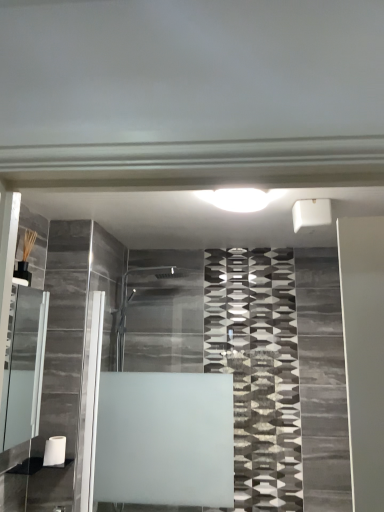
Question: Considering the relative sizes of matte glass cabinet at left and white matte toilet paper at lower left in the image provided, is matte glass cabinet at left shorter than white matte toilet paper at lower left?

Choices:
 (A) no
 (B) yes

Answer: (A)

Question: From the image's perspective, is matte glass cabinet at left below white matte toilet paper at lower left?

Choices:
 (A) yes
 (B) no

Answer: (B)

Question: Is matte glass cabinet at left facing towards white matte toilet paper at lower left?

Choices:
 (A) no
 (B) yes

Answer: (A)

Question: From the image's perspective, is matte glass cabinet at left located above white matte toilet paper at lower left?

Choices:
 (A) no
 (B) yes

Answer: (B)

Question: From a real-world perspective, is matte glass cabinet at left on white matte toilet paper at lower left?

Choices:
 (A) yes
 (B) no

Answer: (A)

Question: In terms of size, does white matte toilet paper at lower left appear bigger or smaller than white glossy light at center?

Choices:
 (A) big
 (B) small

Answer: (B)

Question: Considering their positions, is white matte toilet paper at lower left located in front of or behind white glossy light at center?

Choices:
 (A) front
 (B) behind

Answer: (B)

Question: From the image's perspective, is white matte toilet paper at lower left positioned above or below white glossy light at center?

Choices:
 (A) below
 (B) above

Answer: (A)

Question: Would you say white matte toilet paper at lower left is to the left or to the right of white glossy light at center in the picture?

Choices:
 (A) left
 (B) right

Answer: (A)

Question: Considering the positions of point (218, 473) and point (36, 309), is point (218, 473) closer or farther from the camera than point (36, 309)?

Choices:
 (A) farther
 (B) closer

Answer: (A)

Question: In terms of height, does frosted glass shower door at center look taller or shorter compared to matte glass cabinet at left?

Choices:
 (A) short
 (B) tall

Answer: (B)

Question: Is frosted glass shower door at center wider or thinner than matte glass cabinet at left?

Choices:
 (A) thin
 (B) wide

Answer: (A)

Question: Is frosted glass shower door at center bigger or smaller than matte glass cabinet at left?

Choices:
 (A) big
 (B) small

Answer: (B)

Question: Considering their positions, is frosted glass shower door at center located in front of or behind white glossy light at center?

Choices:
 (A) behind
 (B) front

Answer: (A)

Question: Is frosted glass shower door at center bigger or smaller than white glossy light at center?

Choices:
 (A) big
 (B) small

Answer: (A)